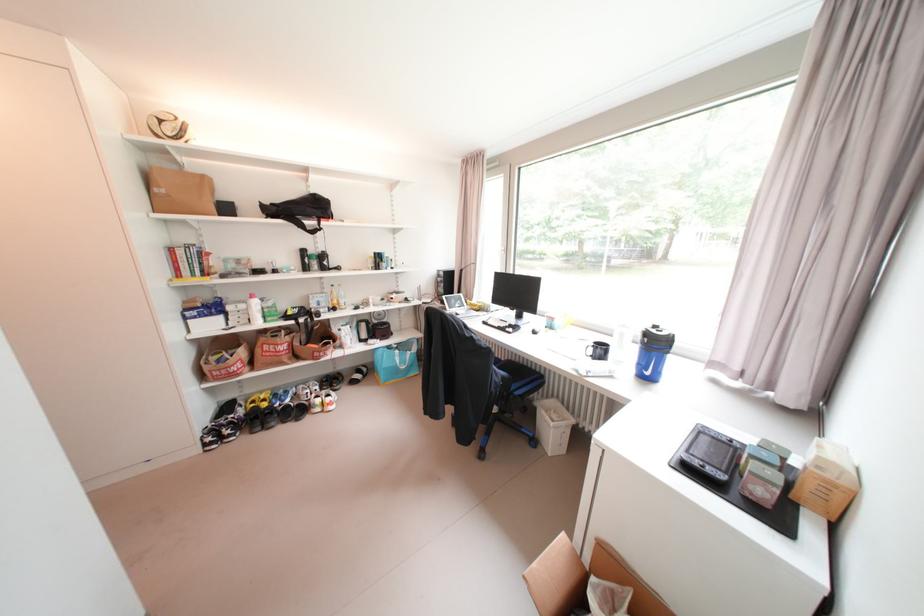
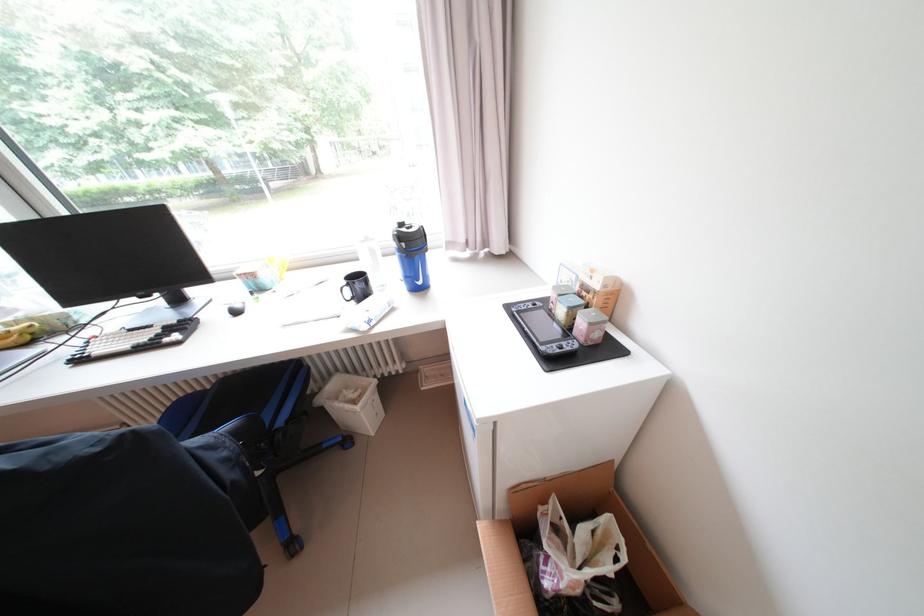
Locate, in the second image, the point that corresponds to point (520, 398) in the first image.

(286, 438)